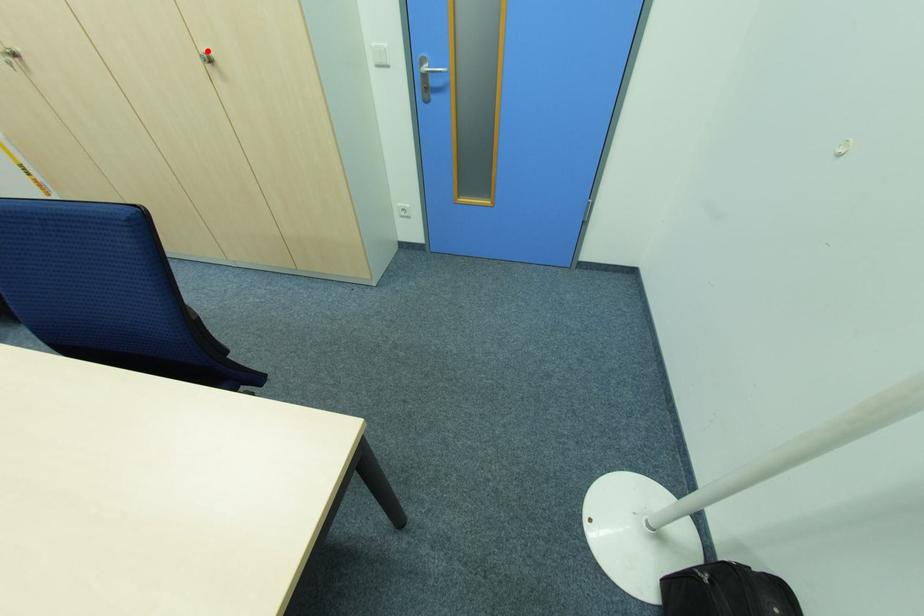
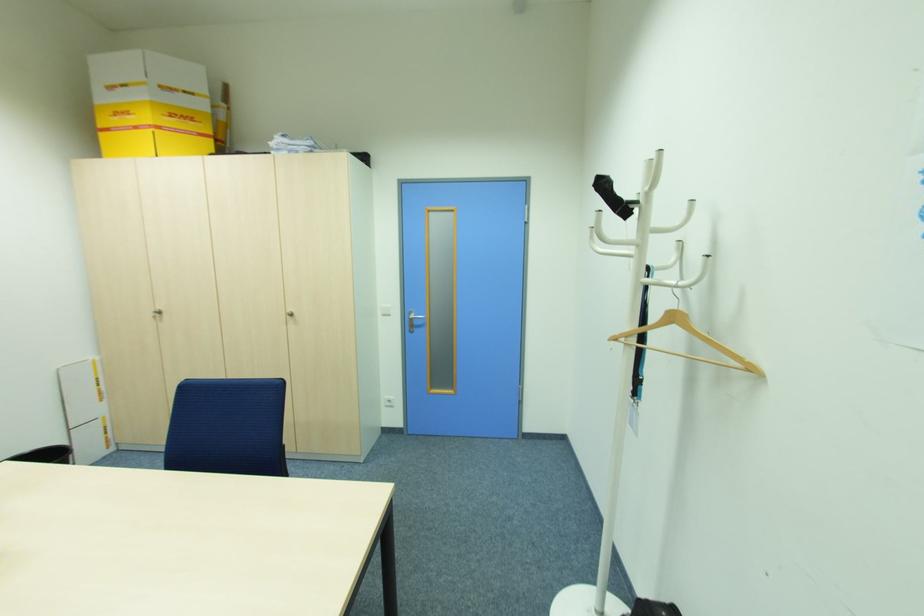
Where in the second image is the point corresponding to the highlighted location from the first image?

(292, 310)